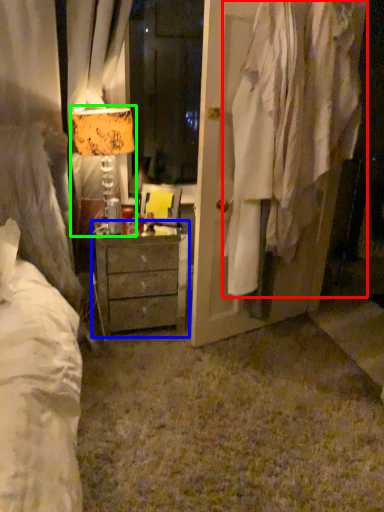
Question: Estimate the real-world distances between objects in this image. Which object is farther from clothing (highlighted by a red box), chest of drawers (highlighted by a blue box) or table lamp (highlighted by a green box)?

Choices:
 (A) chest of drawers
 (B) table lamp

Answer: (B)